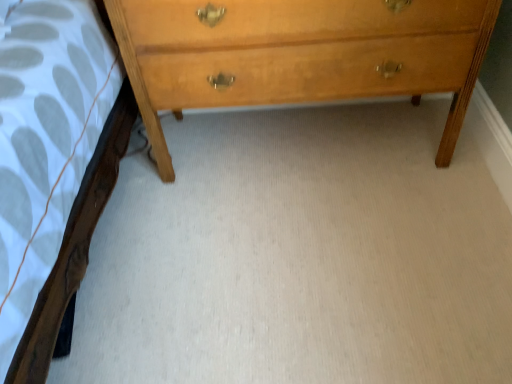
I want to click on free spot below light brown wood chest of drawers at upper center (from a real-world perspective), so click(300, 136).